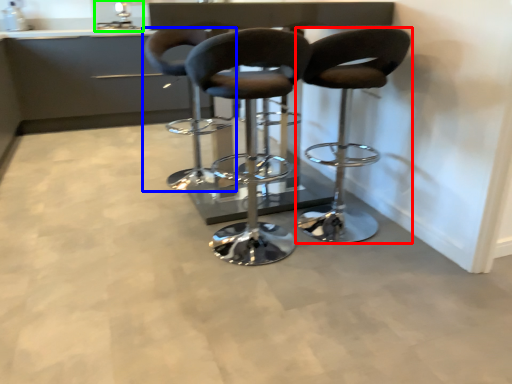
Question: Considering the real-world distances, which object is farthest from chair (highlighted by a red box)? chair (highlighted by a blue box) or sink (highlighted by a green box)?

Choices:
 (A) chair
 (B) sink

Answer: (B)